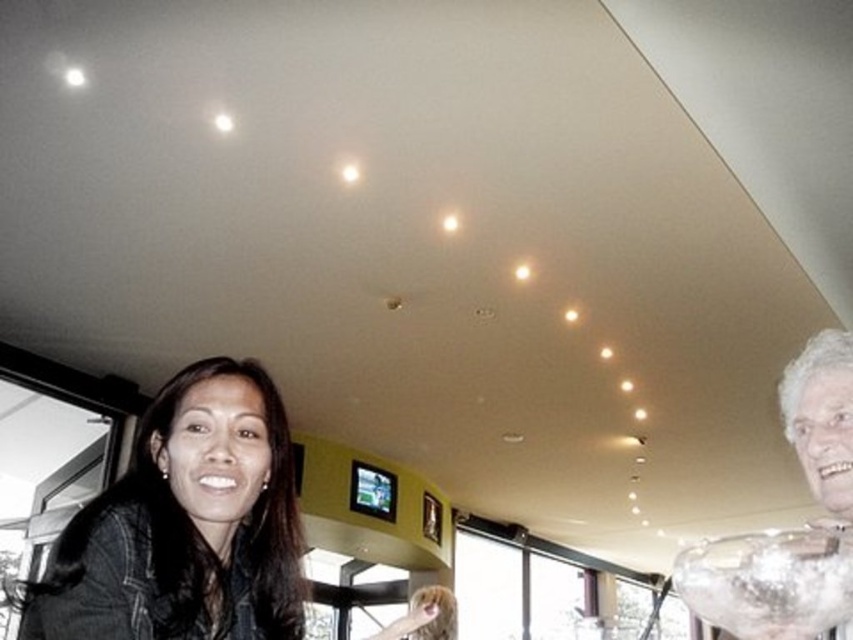
Question: Among these points, which one is farthest from the camera?

Choices:
 (A) (712, 544)
 (B) (134, 476)

Answer: (B)

Question: Which object is the farthest from the clear glass bowl at upper right?

Choices:
 (A) matte black jacket at lower left
 (B) white frosted glass bowl at right

Answer: (A)

Question: Does matte black jacket at lower left appear under clear glass bowl at upper right?

Choices:
 (A) yes
 (B) no

Answer: (B)

Question: From the image, what is the correct spatial relationship of white frosted glass bowl at right in relation to clear glass bowl at upper right?

Choices:
 (A) below
 (B) above

Answer: (B)

Question: Which of the following is the farthest from the observer?

Choices:
 (A) matte black jacket at lower left
 (B) clear glass bowl at upper right
 (C) white frosted glass bowl at right

Answer: (A)

Question: Considering the relative positions of matte black jacket at lower left and white frosted glass bowl at right in the image provided, where is matte black jacket at lower left located with respect to white frosted glass bowl at right?

Choices:
 (A) below
 (B) above

Answer: (A)